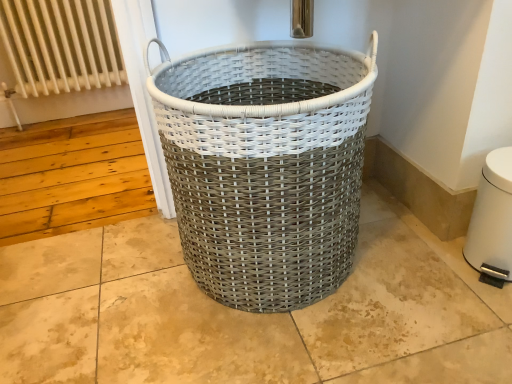
Question: Considering the relative positions of white metal radiator at upper left and white plastic water heater at lower right in the image provided, is white metal radiator at upper left to the right of white plastic water heater at lower right from the viewer's perspective?

Choices:
 (A) yes
 (B) no

Answer: (B)

Question: Does white metal radiator at upper left come behind white plastic water heater at lower right?

Choices:
 (A) no
 (B) yes

Answer: (B)

Question: Is white plastic water heater at lower right surrounded by white metal radiator at upper left?

Choices:
 (A) no
 (B) yes

Answer: (A)

Question: From the image's perspective, is white metal radiator at upper left on top of white plastic water heater at lower right?

Choices:
 (A) no
 (B) yes

Answer: (B)

Question: Is white plastic water heater at lower right at the back of white metal radiator at upper left?

Choices:
 (A) no
 (B) yes

Answer: (A)

Question: Can you confirm if white metal radiator at upper left is taller than white plastic water heater at lower right?

Choices:
 (A) yes
 (B) no

Answer: (A)

Question: Does white plastic water heater at lower right lie behind white woven basket at center?

Choices:
 (A) no
 (B) yes

Answer: (B)

Question: Is white plastic water heater at lower right facing towards white woven basket at center?

Choices:
 (A) yes
 (B) no

Answer: (B)

Question: Is white plastic water heater at lower right thinner than white woven basket at center?

Choices:
 (A) yes
 (B) no

Answer: (A)

Question: Does white plastic water heater at lower right have a greater width compared to white woven basket at center?

Choices:
 (A) no
 (B) yes

Answer: (A)

Question: From the image's perspective, does white plastic water heater at lower right appear lower than white woven basket at center?

Choices:
 (A) no
 (B) yes

Answer: (B)

Question: Can you confirm if white plastic water heater at lower right is shorter than white woven basket at center?

Choices:
 (A) no
 (B) yes

Answer: (B)

Question: Is white woven basket at center next to white metal radiator at upper left and touching it?

Choices:
 (A) no
 (B) yes

Answer: (A)